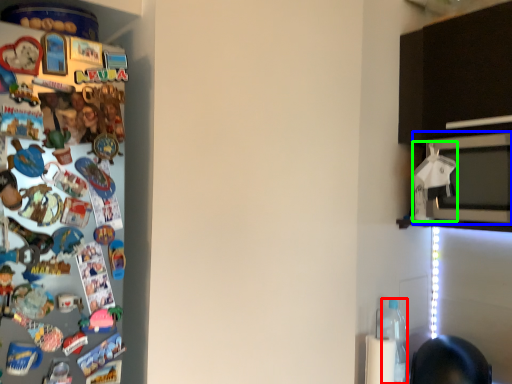
Question: Which object is the closest to the bottle (highlighted by a red box)? Choose among these: microwave oven (highlighted by a blue box) or toy (highlighted by a green box).

Choices:
 (A) microwave oven
 (B) toy

Answer: (B)